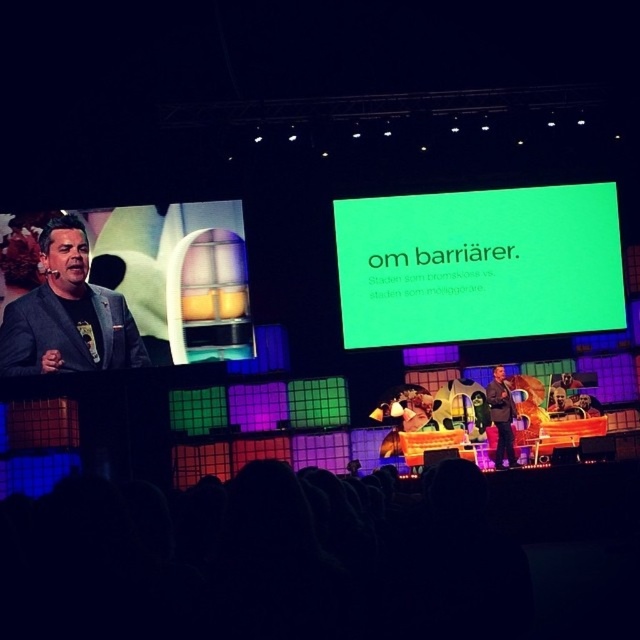
Can you confirm if green matte projection screen at upper center is positioned above dark brown suit at center?

Yes, green matte projection screen at upper center is above dark brown suit at center.

Between green matte projection screen at upper center and dark brown suit at center, which one appears on the right side from the viewer's perspective?

Positioned to the right is green matte projection screen at upper center.

You are a GUI agent. You are given a task and a screenshot of the screen. Output one action in this format:
    pyautogui.click(x=<x>, y=<y>)
    Task: Click on the green matte projection screen at upper center
    
    Given the screenshot: What is the action you would take?
    pyautogui.click(x=477, y=264)

Does green matte projection screen at upper center have a greater height compared to black matte suit at left?

Indeed, green matte projection screen at upper center has a greater height compared to black matte suit at left.

Between green matte projection screen at upper center and black matte suit at left, which one appears on the left side from the viewer's perspective?

From the viewer's perspective, black matte suit at left appears more on the left side.

Locate an element on the screen. green matte projection screen at upper center is located at coordinates (477, 264).

Can you confirm if black matte suit at left is thinner than dark brown suit at center?

No.

You are a GUI agent. You are given a task and a screenshot of the screen. Output one action in this format:
    pyautogui.click(x=<x>, y=<y>)
    Task: Click on the black matte suit at left
    The height and width of the screenshot is (640, 640).
    Given the screenshot: What is the action you would take?
    pyautogui.click(x=67, y=333)

This screenshot has height=640, width=640. I want to click on black matte suit at left, so click(x=67, y=333).